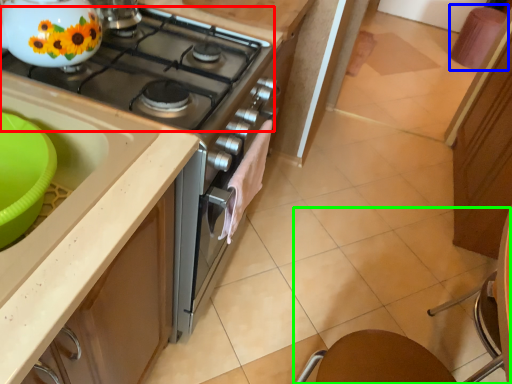
Question: Considering the real-world distances, which object is farthest from gas stove (highlighted by a red box)? bar stool (highlighted by a blue box) or chair (highlighted by a green box)?

Choices:
 (A) bar stool
 (B) chair

Answer: (A)